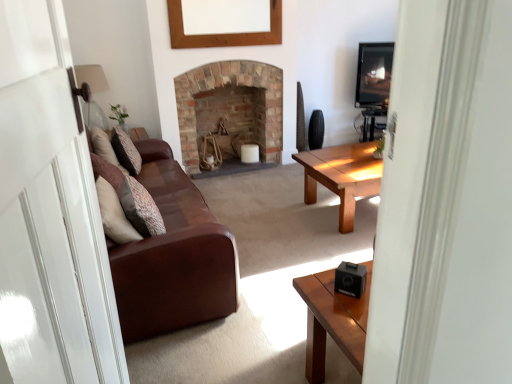
The height and width of the screenshot is (384, 512). In order to click on wooden picture frame at upper center in this screenshot , I will do `click(225, 31)`.

The image size is (512, 384). Find the location of `matte glass lampshade at upper left`. matte glass lampshade at upper left is located at coordinates (92, 92).

Describe the element at coordinates (126, 151) in the screenshot. The height and width of the screenshot is (384, 512). I see `patterned fabric pillow at left, which is the second pillow in front-to-back order` at that location.

This screenshot has width=512, height=384. Identify the location of black plastic speaker at lower right. (350, 279).

In the scene shown: Considering the relative sizes of patterned fabric pillow at left, the first pillow positioned from the right, and wooden picture frame at upper center in the image provided, is patterned fabric pillow at left, the first pillow positioned from the right, smaller than wooden picture frame at upper center?

No.

Considering the relative positions of patterned fabric pillow at left, the 2th pillow from the back, and wooden picture frame at upper center in the image provided, is patterned fabric pillow at left, the 2th pillow from the back, to the left of wooden picture frame at upper center from the viewer's perspective?

Yes, patterned fabric pillow at left, the 2th pillow from the back, is to the left of wooden picture frame at upper center.

What's the angular difference between patterned fabric pillow at left, the first pillow positioned from the right, and wooden picture frame at upper center's facing directions?

91.9 degrees.

Image resolution: width=512 pixels, height=384 pixels. I want to click on the 1st pillow counting from the left side of the wooden picture frame at upper center, so click(x=140, y=208).

How different are the orientations of wooden picture frame at upper center and patterned fabric pillow at left, the second pillow when ordered from top to bottom, in degrees?

The angle between the facing direction of wooden picture frame at upper center and the facing direction of patterned fabric pillow at left, the second pillow when ordered from top to bottom, is 91.9 degrees.

Measure the distance from wooden picture frame at upper center to patterned fabric pillow at left, which appears as the first pillow when ordered from the bottom.

A distance of 2.30 meters exists between wooden picture frame at upper center and patterned fabric pillow at left, which appears as the first pillow when ordered from the bottom.

Which is in front, wooden picture frame at upper center or patterned fabric pillow at left, the first pillow positioned from the right?

patterned fabric pillow at left, the first pillow positioned from the right, is more forward.

From the image's perspective, relative to patterned fabric pillow at left, marked as the 2th pillow in a left-to-right arrangement, is wooden picture frame at upper center above or below?

Based on their image positions, wooden picture frame at upper center is located above patterned fabric pillow at left, marked as the 2th pillow in a left-to-right arrangement.

Considering the relative sizes of transparent glass door at left and matte glass lampshade at upper left in the image provided, is transparent glass door at left bigger than matte glass lampshade at upper left?

Yes.

Is transparent glass door at left oriented away from matte glass lampshade at upper left?

No, matte glass lampshade at upper left is not at the back of transparent glass door at left.

Considering the sizes of objects transparent glass door at left and matte glass lampshade at upper left in the image provided, who is taller, transparent glass door at left or matte glass lampshade at upper left?

transparent glass door at left.

Is point (36, 345) farther from viewer compared to point (102, 123)?

That is False.

Locate an element on the screen. speaker that is below the patterned fabric pillow at left, the second pillow when ordered from top to bottom (from the image's perspective) is located at coordinates (350, 279).

Is black plastic speaker at lower right looking in the opposite direction of patterned fabric pillow at left, the first pillow positioned from the right?

No, patterned fabric pillow at left, the first pillow positioned from the right, is not at the back of black plastic speaker at lower right.

Considering the positions of points (351, 270) and (136, 208), is point (351, 270) farther from camera compared to point (136, 208)?

No, (351, 270) is closer to viewer.

Is matte glass lampshade at upper left taller or shorter than brown leather couch at left?

In the image, matte glass lampshade at upper left appears to be shorter than brown leather couch at left.

Is matte glass lampshade at upper left to the right of brown leather couch at left from the viewer's perspective?

Incorrect, matte glass lampshade at upper left is not on the right side of brown leather couch at left.

From the image's perspective, is matte glass lampshade at upper left positioned above or below brown leather couch at left?

matte glass lampshade at upper left is situated higher than brown leather couch at left in the image.

Which object is closer to the camera, matte glass lampshade at upper left or brown leather couch at left?

Positioned in front is brown leather couch at left.

Between brick fireplace at center and transparent glass door at left, which one is positioned behind?

brick fireplace at center is behind.

Is brick fireplace at center aimed at transparent glass door at left?

Yes, brick fireplace at center is turned towards transparent glass door at left.

From a real-world perspective, is brick fireplace at center located higher than transparent glass door at left?

Actually, brick fireplace at center is physically below transparent glass door at left in the real world.

In the scene shown: Are brick fireplace at center and transparent glass door at left beside each other?

No, brick fireplace at center is not touching transparent glass door at left.

Is black plastic speaker at lower right wider or thinner than wooden picture frame at upper center?

Clearly, black plastic speaker at lower right has more width compared to wooden picture frame at upper center.

Considering the relative sizes of black plastic speaker at lower right and wooden picture frame at upper center in the image provided, is black plastic speaker at lower right shorter than wooden picture frame at upper center?

Yes, black plastic speaker at lower right is shorter than wooden picture frame at upper center.

From a real-world perspective, between black plastic speaker at lower right and wooden picture frame at upper center, who is vertically higher?

wooden picture frame at upper center.

Identify the location of picture frame above the patterned fabric pillow at left, the first pillow positioned from the right (from the image's perspective). (225, 31).

You are a GUI agent. You are given a task and a screenshot of the screen. Output one action in this format:
    pyautogui.click(x=<x>, y=<y>)
    Task: Click on the picture frame on the right of patterned fabric pillow at left, which appears as the first pillow when ordered from the bottom
    The height and width of the screenshot is (384, 512).
    Given the screenshot: What is the action you would take?
    pyautogui.click(x=225, y=31)

Based on their spatial positions, is patterned fabric pillow at left, placed as the second pillow when sorted from right to left, or patterned fabric pillow at left, which appears as the first pillow when ordered from the bottom, further from transparent glass door at left?

patterned fabric pillow at left, placed as the second pillow when sorted from right to left, is positioned further to the anchor transparent glass door at left.

Which object lies nearer to the anchor point matte glass lampshade at upper left, brick fireplace at center or wooden picture frame at upper center?

brick fireplace at center is closer to matte glass lampshade at upper left.

From the image, which object appears to be farther from brick fireplace at center, transparent glass door at left or patterned fabric pillow at left, acting as the first pillow starting from the back?

transparent glass door at left.

Based on their spatial positions, is brown leather couch at left or patterned fabric pillow at left, which ranks as the first pillow in top-to-bottom order, closer to transparent glass door at left?

brown leather couch at left.

From the picture: Based on their spatial positions, is black plastic speaker at lower right or brown leather couch at left closer to wooden picture frame at upper center?

brown leather couch at left is closer to wooden picture frame at upper center.

Based on their spatial positions, is wooden picture frame at upper center or matte glass lampshade at upper left closer to brick fireplace at center?

wooden picture frame at upper center is positioned closer to the anchor brick fireplace at center.

Considering their positions, is black plastic speaker at lower right positioned closer to brick fireplace at center than patterned fabric pillow at left, the 1th pillow in the left-to-right sequence?

Among the two, patterned fabric pillow at left, the 1th pillow in the left-to-right sequence, is located nearer to brick fireplace at center.

Looking at the image, which one is located closer to matte glass lampshade at upper left, transparent glass door at left or wooden picture frame at upper center?

wooden picture frame at upper center.

What are the coordinates of `studio couch between black plastic speaker at lower right and wooden picture frame at upper center from front to back` in the screenshot? It's located at (174, 257).

I want to click on picture frame between black plastic speaker at lower right and brick fireplace at center from front to back, so click(x=225, y=31).

Identify the location of speaker between transparent glass door at left and matte glass lampshade at upper left from front to back. Image resolution: width=512 pixels, height=384 pixels. pos(350,279).

This screenshot has width=512, height=384. Find the location of `lamp positioned between transparent glass door at left and brick fireplace at center from near to far`. lamp positioned between transparent glass door at left and brick fireplace at center from near to far is located at coordinates (92, 92).